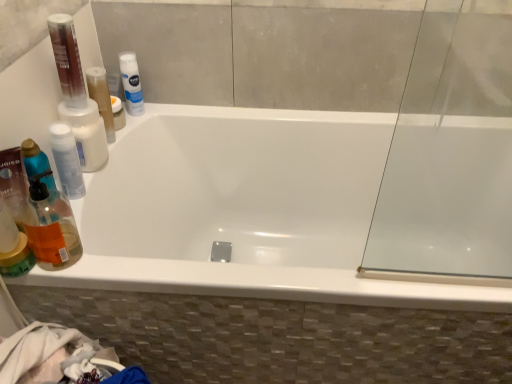
What is the approximate height of white matte nivea spray at upper center, acting as the 1th mouthwash starting from the back?

The height of white matte nivea spray at upper center, acting as the 1th mouthwash starting from the back, is 19.66 centimeters.

At what (x,y) coordinates should I click in order to perform the action: click on white glossy bathtub at center. Please return your answer as a coordinate pair (x, y). This screenshot has height=384, width=512. Looking at the image, I should click on (244, 210).

From the picture: Measure the distance between transparent plastic bottle at left, the first mouthwash in the front-to-back sequence, and camera.

transparent plastic bottle at left, the first mouthwash in the front-to-back sequence, and camera are 36.25 inches apart from each other.

Image resolution: width=512 pixels, height=384 pixels. What are the coordinates of `white matte nivea spray at upper center, which is the 3th mouthwash in front-to-back order` in the screenshot? It's located at (131, 83).

Considering the points (143, 107) and (48, 254), which point is in front, point (143, 107) or point (48, 254)?

The point (48, 254) is closer to the camera.

How different are the orientations of white matte nivea spray at upper center, which is the 3th mouthwash in front-to-back order, and translucent orange liquid at left in degrees?

The angle between the facing direction of white matte nivea spray at upper center, which is the 3th mouthwash in front-to-back order, and the facing direction of translucent orange liquid at left is 0.00331 degrees.

Measure the distance between white matte nivea spray at upper center, acting as the 1th mouthwash starting from the back, and translucent orange liquid at left.

They are 19.85 inches apart.

Is white matte nivea spray at upper center, acting as the 1th mouthwash starting from the back, next to translucent orange liquid at left and touching it?

No, white matte nivea spray at upper center, acting as the 1th mouthwash starting from the back, is not touching translucent orange liquid at left.

From the picture: Which object is closer to the camera taking this photo, white opaque bottle at upper left, which is counted as the second mouthwash, starting from the back, or white glossy bathtub at center?

white glossy bathtub at center is closer to the camera.

Between white opaque bottle at upper left, which is counted as the second mouthwash, starting from the back, and white glossy bathtub at center, which one has larger width?

white glossy bathtub at center is wider.

Could you measure the distance between white opaque bottle at upper left, which is counted as the second mouthwash, starting from the back, and white glossy bathtub at center?

The distance of white opaque bottle at upper left, which is counted as the second mouthwash, starting from the back, from white glossy bathtub at center is 43.25 centimeters.

Is white opaque bottle at upper left, which is counted as the second mouthwash, starting from the back, next to white glossy bathtub at center and touching it?

white opaque bottle at upper left, which is counted as the second mouthwash, starting from the back, and white glossy bathtub at center are not in contact.

Who is taller, white glossy bathtub at center or transparent plastic bottle at left, which ranks as the 3th mouthwash in back-to-front order?

Standing taller between the two is white glossy bathtub at center.

What's the angular difference between white glossy bathtub at center and transparent plastic bottle at left, the first mouthwash in the front-to-back sequence,'s facing directions?

There is a 90-degree angle between the facing directions of white glossy bathtub at center and transparent plastic bottle at left, the first mouthwash in the front-to-back sequence.

I want to click on the 1st mouthwash behind when counting from the white glossy bathtub at center, so click(67, 160).

Which point is more distant from viewer, [182,151] or [74,149]?

Positioned behind is point [182,151].

Is transparent plastic bottle at left, which ranks as the 3th mouthwash in back-to-front order, taller or shorter than translucent orange liquid at left?

Considering their sizes, transparent plastic bottle at left, which ranks as the 3th mouthwash in back-to-front order, has less height than translucent orange liquid at left.

Looking at this image, is transparent plastic bottle at left, which ranks as the 3th mouthwash in back-to-front order, looking in the opposite direction of translucent orange liquid at left?

No, transparent plastic bottle at left, which ranks as the 3th mouthwash in back-to-front order, is not facing away from translucent orange liquid at left.

From the image's perspective, would you say transparent plastic bottle at left, which ranks as the 3th mouthwash in back-to-front order, is positioned over translucent orange liquid at left?

Correct, transparent plastic bottle at left, which ranks as the 3th mouthwash in back-to-front order, appears higher than translucent orange liquid at left in the image.

Is point (119, 168) less distant than point (41, 266)?

That is False.

Is white glossy bathtub at center facing towards translucent orange liquid at left?

No, white glossy bathtub at center is not turned towards translucent orange liquid at left.

Can we say white glossy bathtub at center lies outside translucent orange liquid at left?

That's correct, white glossy bathtub at center is outside of translucent orange liquid at left.

In the image, is white glossy bathtub at center positioned in front of or behind translucent orange liquid at left?

Clearly, white glossy bathtub at center is behind translucent orange liquid at left.

Does translucent orange liquid at left come behind white opaque bottle at upper left, which appears as the second mouthwash when viewed from the front?

No, translucent orange liquid at left is in front of white opaque bottle at upper left, which appears as the second mouthwash when viewed from the front.

Is translucent orange liquid at left directly adjacent to white opaque bottle at upper left, which is counted as the second mouthwash, starting from the back?

There is a gap between translucent orange liquid at left and white opaque bottle at upper left, which is counted as the second mouthwash, starting from the back.

Is point (44, 188) more distant than point (104, 112)?

No, (44, 188) is in front of (104, 112).

Which of these two, translucent orange liquid at left or transparent plastic bottle at left, the first mouthwash in the front-to-back sequence, stands taller?

Standing taller between the two is translucent orange liquid at left.

Relative to transparent plastic bottle at left, the first mouthwash in the front-to-back sequence, is translucent orange liquid at left in front or behind?

translucent orange liquid at left is positioned closer to the viewer than transparent plastic bottle at left, the first mouthwash in the front-to-back sequence.

Where is `cleaning product below the transparent plastic bottle at left, the first mouthwash in the front-to-back sequence (from the image's perspective)`? The width and height of the screenshot is (512, 384). cleaning product below the transparent plastic bottle at left, the first mouthwash in the front-to-back sequence (from the image's perspective) is located at coordinates (51, 226).

Looking at this image, is translucent orange liquid at left oriented away from transparent plastic bottle at left, the first mouthwash in the front-to-back sequence?

No, translucent orange liquid at left's orientation is not away from transparent plastic bottle at left, the first mouthwash in the front-to-back sequence.

The image size is (512, 384). Find the location of `cleaning product below the white matte nivea spray at upper center, acting as the 1th mouthwash starting from the back (from the image's perspective)`. cleaning product below the white matte nivea spray at upper center, acting as the 1th mouthwash starting from the back (from the image's perspective) is located at coordinates (51, 226).

At what (x,y) coordinates should I click in order to perform the action: click on the 2nd mouthwash counting from the left of the white glossy bathtub at center. Please return your answer as a coordinate pair (x, y). Looking at the image, I should click on (101, 98).

From the image, which object appears to be nearer to transparent plastic bottle at left, which ranks as the 3th mouthwash in back-to-front order, translucent orange liquid at left or white glossy bathtub at center?

translucent orange liquid at left is closer to transparent plastic bottle at left, which ranks as the 3th mouthwash in back-to-front order.

Looking at the image, which one is located closer to white matte nivea spray at upper center, acting as the 1th mouthwash starting from the back, white opaque bottle at upper left, which is counted as the second mouthwash, starting from the back, or white glossy bathtub at center?

white opaque bottle at upper left, which is counted as the second mouthwash, starting from the back.

Considering their positions, is white glossy bathtub at center positioned closer to white opaque bottle at upper left, which appears as the second mouthwash when viewed from the front, than translucent orange liquid at left?

Among the two, translucent orange liquid at left is located nearer to white opaque bottle at upper left, which appears as the second mouthwash when viewed from the front.

Estimate the real-world distances between objects in this image. Which object is further from white opaque bottle at upper left, which appears as the second mouthwash when viewed from the front, transparent plastic bottle at left, which ranks as the 3th mouthwash in back-to-front order, or white glossy bathtub at center?

Based on the image, white glossy bathtub at center appears to be further to white opaque bottle at upper left, which appears as the second mouthwash when viewed from the front.

Estimate the real-world distances between objects in this image. Which object is further from white glossy bathtub at center, white matte nivea spray at upper center, acting as the 1th mouthwash starting from the back, or white opaque bottle at upper left, which appears as the second mouthwash when viewed from the front?

Among the two, white matte nivea spray at upper center, acting as the 1th mouthwash starting from the back, is located further to white glossy bathtub at center.

From the image, which object appears to be farther from white opaque bottle at upper left, which is counted as the second mouthwash, starting from the back, white glossy bathtub at center or white matte nivea spray at upper center, which is the 3th mouthwash in front-to-back order?

white glossy bathtub at center lies further to white opaque bottle at upper left, which is counted as the second mouthwash, starting from the back, than the other object.

Looking at the image, which one is located closer to white matte nivea spray at upper center, which is the 3th mouthwash in front-to-back order, white glossy bathtub at center or white opaque bottle at upper left, which appears as the second mouthwash when viewed from the front?

white opaque bottle at upper left, which appears as the second mouthwash when viewed from the front, lies closer to white matte nivea spray at upper center, which is the 3th mouthwash in front-to-back order, than the other object.

Which object lies further to the anchor point white glossy bathtub at center, transparent plastic bottle at left, which ranks as the 3th mouthwash in back-to-front order, or translucent orange liquid at left?

transparent plastic bottle at left, which ranks as the 3th mouthwash in back-to-front order, is positioned further to the anchor white glossy bathtub at center.

At what (x,y) coordinates should I click in order to perform the action: click on mouthwash located between white opaque bottle at upper left, which appears as the second mouthwash when viewed from the front, and white glossy bathtub at center in the left-right direction. Please return your answer as a coordinate pair (x, y). Looking at the image, I should click on (131, 83).

I want to click on mouthwash between translucent orange liquid at left and white opaque bottle at upper left, which is counted as the second mouthwash, starting from the back, along the z-axis, so click(67, 160).

Find the location of `cleaning product situated between transparent plastic bottle at left, the first mouthwash in the front-to-back sequence, and white glossy bathtub at center from left to right`. cleaning product situated between transparent plastic bottle at left, the first mouthwash in the front-to-back sequence, and white glossy bathtub at center from left to right is located at coordinates 51,226.

The width and height of the screenshot is (512, 384). In order to click on mouthwash between translucent orange liquid at left and white glossy bathtub at center from left to right in this screenshot , I will do `click(131, 83)`.